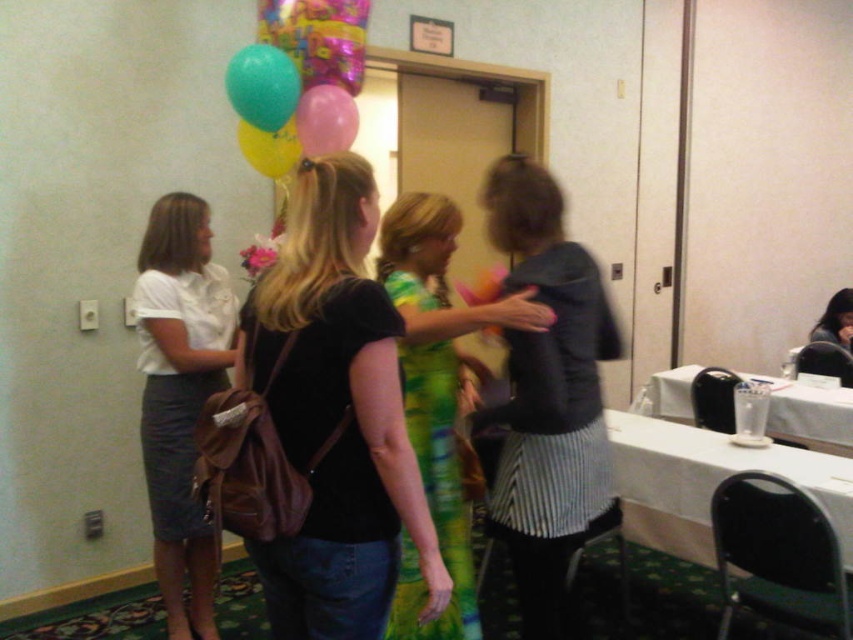
Does striped fabric skirt at center appear on the right side of translucent rubber balloon at upper left?

Yes, striped fabric skirt at center is to the right of translucent rubber balloon at upper left.

Which is behind, point (546, 208) or point (258, 112)?

The point (258, 112) is more distant.

Image resolution: width=853 pixels, height=640 pixels. In order to click on striped fabric skirt at center in this screenshot , I will do `click(547, 396)`.

Does striped fabric skirt at center have a greater height compared to green textured dress at center?

Yes.

Can you confirm if striped fabric skirt at center is shorter than green textured dress at center?

In fact, striped fabric skirt at center may be taller than green textured dress at center.

Find the location of `striped fabric skirt at center`. striped fabric skirt at center is located at coordinates (547, 396).

This screenshot has width=853, height=640. Describe the element at coordinates (325, 120) in the screenshot. I see `pink rubber balloon at center` at that location.

Does pink rubber balloon at center have a greater height compared to smooth black hair at center?

No.

Where is `pink rubber balloon at center`? pink rubber balloon at center is located at coordinates (325, 120).